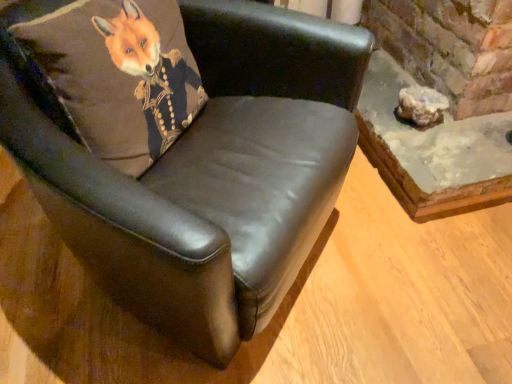
You are a GUI agent. You are given a task and a screenshot of the screen. Output one action in this format:
    pyautogui.click(x=<x>, y=<y>)
    Task: Click on the free space in front of translucent white rock at lower right
    The image size is (512, 384).
    Given the screenshot: What is the action you would take?
    pyautogui.click(x=436, y=148)